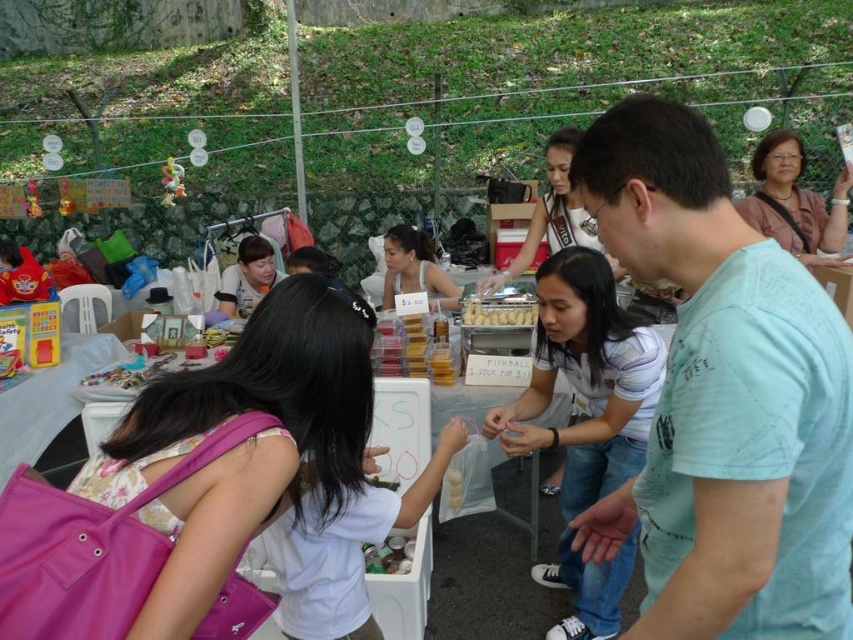
You are a customer at the market and want to buy both the yellow matte candy at center and the plush yellow bear at upper left. Which item is located lower in the image?

The yellow matte candy at center is positioned under the plush yellow bear at upper left, so it is located lower in the image.